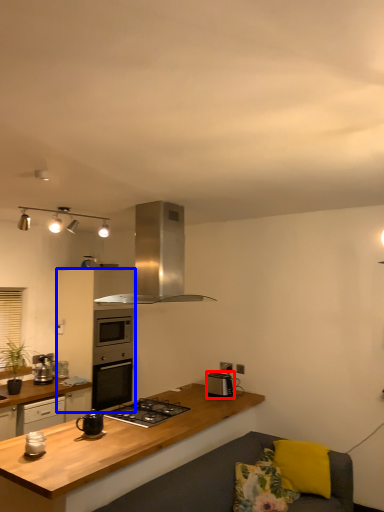
Question: Which object appears closest to the camera in this image, kitchen appliance (highlighted by a red box) or cabinetry (highlighted by a blue box)?

Choices:
 (A) kitchen appliance
 (B) cabinetry

Answer: (A)